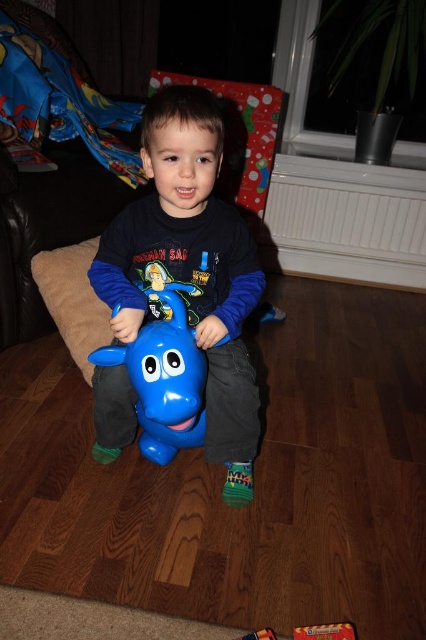
You are a parent trying to locate your child in the living room. You remember seeing them near two specific points marked as point 1 and point 2. Point 1 is at coordinates (238, 448) and point 2 is at (141, 449). Which point is closer to the child sitting on the blue plastic toy horse?

Point 1 at coordinates (238, 448) is closer to the child sitting on the blue plastic toy horse because it is in front of point 2 at (141, 449).

You are a parent trying to choose between two toy horses for your child. The matte plastic toy horse at center and the blue rubber horse at center. Which one is closer to your child?

The matte plastic toy horse at center is closer to your child because it is positioned further to the viewer than the blue rubber horse at center.